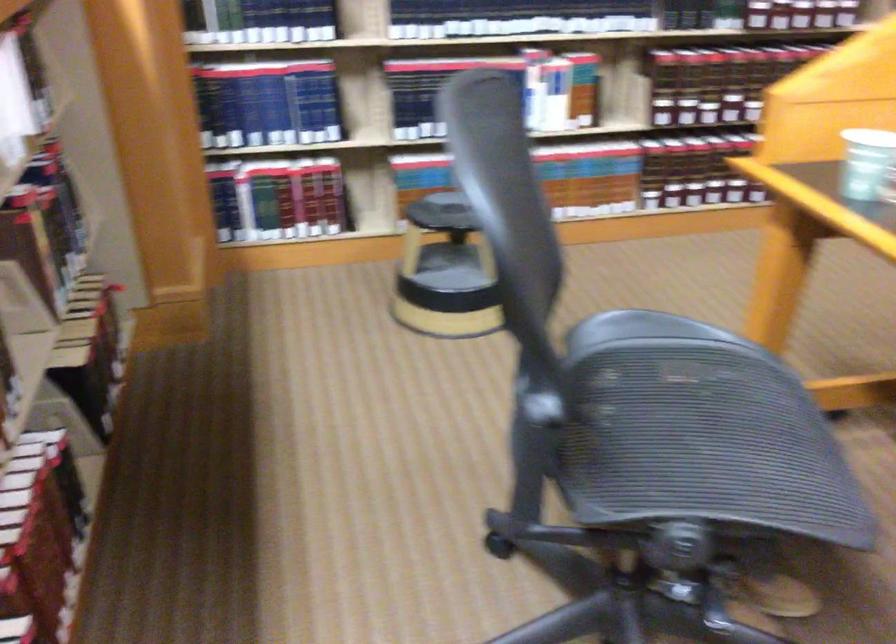
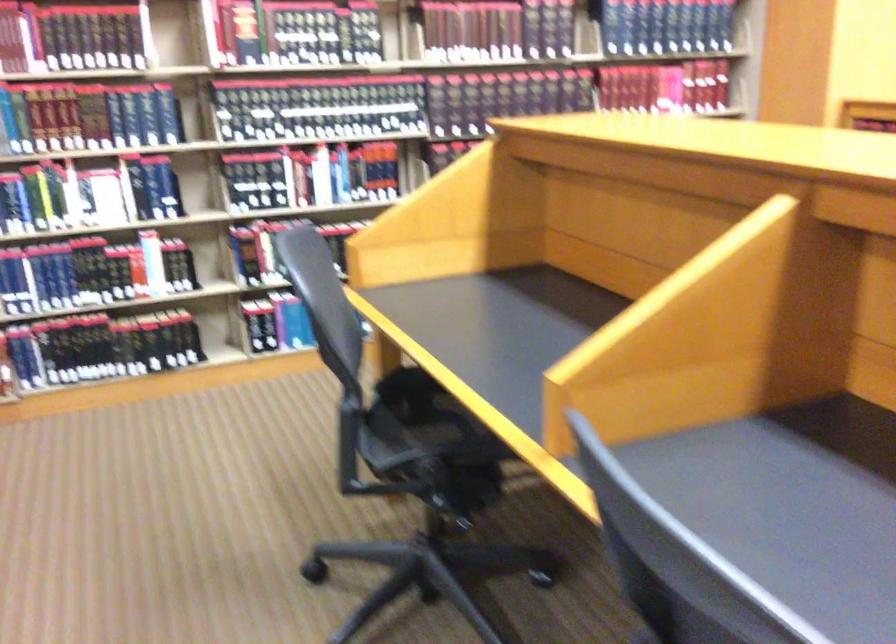
Question: The images are taken continuously from a first-person perspective. In which direction are you moving?

Choices:
 (A) Left
 (B) Right
 (C) Forward
 (D) Backward

Answer: (B)